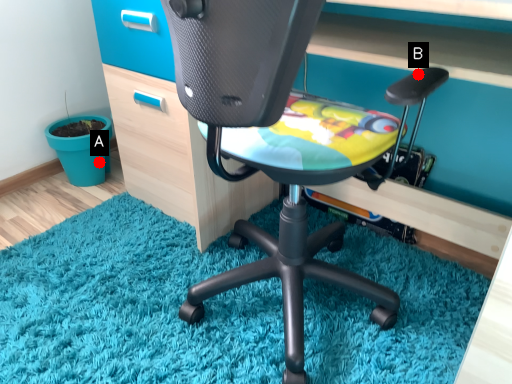
Question: Two points are circled on the image, labeled by A and B beside each circle. Which point is further to the camera?

Choices:
 (A) A is further
 (B) B is further

Answer: (A)